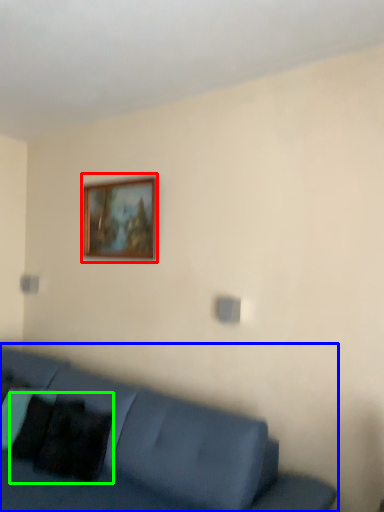
Question: Which object is positioned farthest from picture frame (highlighted by a red box)? Select from studio couch (highlighted by a blue box) and pillow (highlighted by a green box).

Choices:
 (A) studio couch
 (B) pillow

Answer: (B)